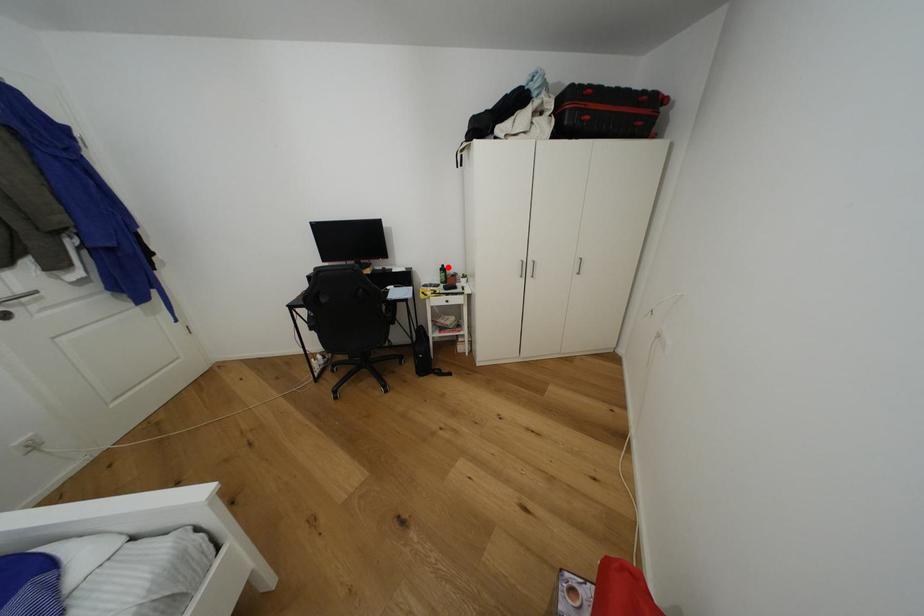
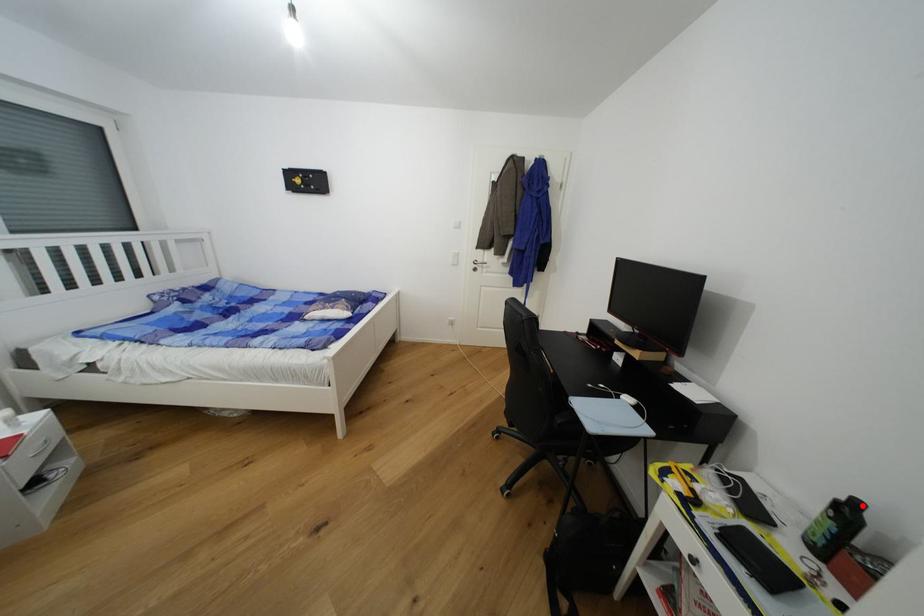
I am providing you with two images of the same scene from different viewpoints. A red point is marked on the first image and another point is marked on the second image. Is the red point in image1 aligned with the point shown in image2?

Yes